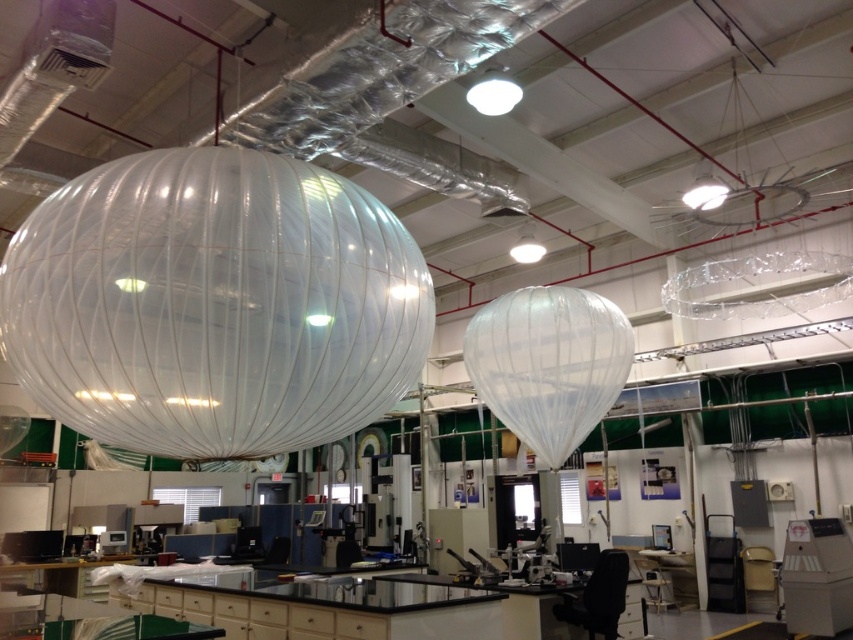
Question: Considering the relative positions of transparent ribbed balloon at center and transparent plastic balloon at center in the image provided, where is transparent ribbed balloon at center located with respect to transparent plastic balloon at center?

Choices:
 (A) left
 (B) right

Answer: (B)

Question: Is transparent ribbed balloon at center to the right of transparent plastic balloon at center from the viewer's perspective?

Choices:
 (A) yes
 (B) no

Answer: (A)

Question: Among these objects, which one is farthest from the camera?

Choices:
 (A) transparent plastic balloon at center
 (B) transparent plastic balloon at upper left
 (C) transparent ribbed balloon at center

Answer: (A)

Question: Which object is farther from the camera taking this photo?

Choices:
 (A) transparent plastic balloon at upper left
 (B) transparent plastic balloon at center

Answer: (B)

Question: Among these points, which one is nearest to the camera?

Choices:
 (A) (7, 433)
 (B) (293, 332)
 (C) (596, 333)

Answer: (B)

Question: Can you confirm if transparent plastic balloon at upper left is wider than transparent plastic balloon at center?

Choices:
 (A) no
 (B) yes

Answer: (B)